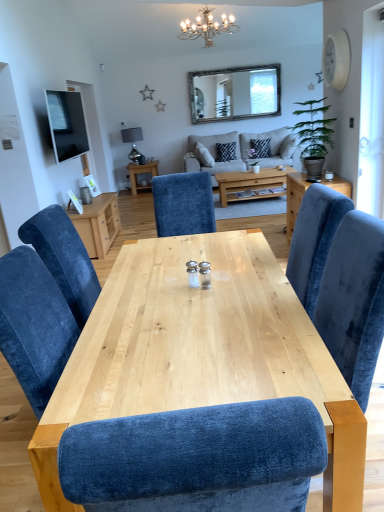
Question: From a real-world perspective, is white metallic chandelier at upper center positioned over matte black tv at upper left based on gravity?

Choices:
 (A) no
 (B) yes

Answer: (B)

Question: Is white metallic chandelier at upper center at the right side of matte black tv at upper left?

Choices:
 (A) no
 (B) yes

Answer: (B)

Question: From the image's perspective, does white metallic chandelier at upper center appear higher than matte black tv at upper left?

Choices:
 (A) yes
 (B) no

Answer: (A)

Question: Does white metallic chandelier at upper center have a lesser width compared to matte black tv at upper left?

Choices:
 (A) no
 (B) yes

Answer: (A)

Question: Is white metallic chandelier at upper center wider than matte black tv at upper left?

Choices:
 (A) no
 (B) yes

Answer: (B)

Question: Can you confirm if white metallic chandelier at upper center is bigger than matte black tv at upper left?

Choices:
 (A) no
 (B) yes

Answer: (B)

Question: From the image's perspective, is matte black tv at upper left above velvet blue chair at right, the 2th table in the top-to-bottom sequence?

Choices:
 (A) no
 (B) yes

Answer: (B)

Question: Is matte black tv at upper left aimed at velvet blue chair at right, the 1th table viewed from the right?

Choices:
 (A) yes
 (B) no

Answer: (A)

Question: Does matte black tv at upper left come behind velvet blue chair at right, positioned as the 2th table in front-to-back order?

Choices:
 (A) yes
 (B) no

Answer: (A)

Question: Considering the relative sizes of matte black tv at upper left and velvet blue chair at right, the 1th table viewed from the right, in the image provided, is matte black tv at upper left taller than velvet blue chair at right, the 1th table viewed from the right,?

Choices:
 (A) yes
 (B) no

Answer: (B)

Question: Does matte black tv at upper left have a lesser width compared to velvet blue chair at right, marked as the 2th table in a bottom-to-top arrangement?

Choices:
 (A) yes
 (B) no

Answer: (A)

Question: Is matte black tv at upper left with velvet blue chair at right, the 2th table in the top-to-bottom sequence?

Choices:
 (A) yes
 (B) no

Answer: (B)

Question: Would you consider wooden-framed mirror at upper center to be distant from white metallic chandelier at upper center?

Choices:
 (A) no
 (B) yes

Answer: (A)